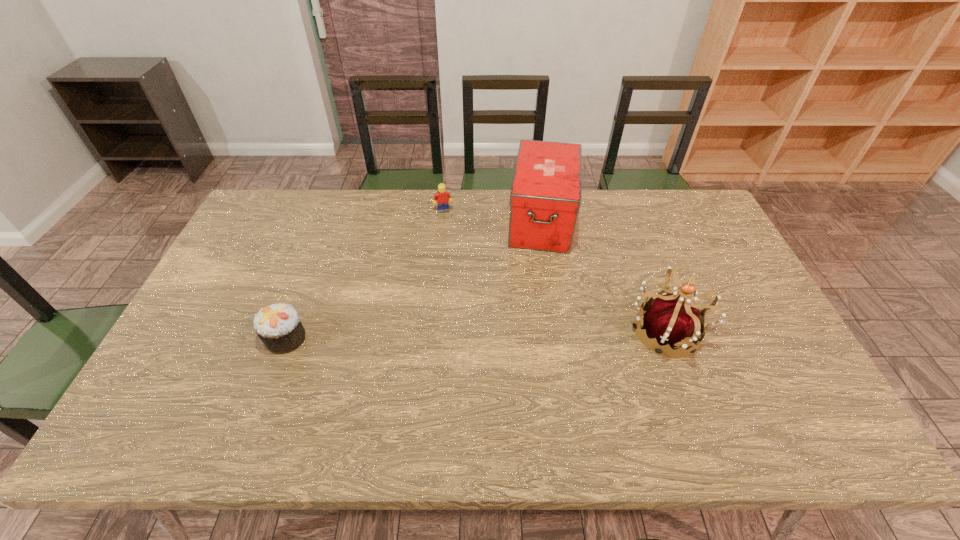
Identify which object is the third closest to the third object from left to right. Please provide its 2D coordinates. Your answer should be formatted as a tuple, i.e. [(x, y)], where the tuple contains the x and y coordinates of a point satisfying the conditions above.

[(278, 326)]

Locate which object is the closest to the Lego. Please provide its 2D coordinates. Your answer should be formatted as a tuple, i.e. [(x, y)], where the tuple contains the x and y coordinates of a point satisfying the conditions above.

[(545, 197)]

The width and height of the screenshot is (960, 540). Identify the location of free space in the image that satisfies the following two spatial constraints: 1. on the front side of the second object from right to left; 2. on the right side of the third object from right to left. (443, 220).

The height and width of the screenshot is (540, 960). I want to click on free spot that satisfies the following two spatial constraints: 1. on the back side of the third object from right to left; 2. on the right side of the leftmost object, so click(333, 211).

I want to click on vacant point that satisfies the following two spatial constraints: 1. on the back side of the cupcake; 2. on the front-facing side of the tiara, so click(288, 332).

At what (x,y) coordinates should I click in order to perform the action: click on free space that satisfies the following two spatial constraints: 1. on the back side of the second object from left to right; 2. on the right side of the cupcake. Please return your answer as a coordinate pair (x, y). Looking at the image, I should click on [333, 211].

Find the location of a particular element. This screenshot has height=540, width=960. blank area in the image that satisfies the following two spatial constraints: 1. on the front side of the rightmost object; 2. on the front-facing side of the third object from left to right is located at coordinates (559, 332).